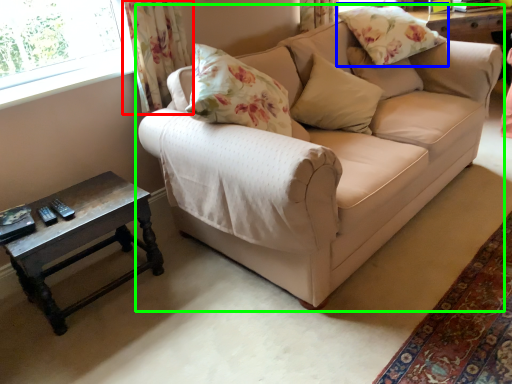
Question: Which is farther away from curtain (highlighted by a red box)? pillow (highlighted by a blue box) or studio couch (highlighted by a green box)?

Choices:
 (A) pillow
 (B) studio couch

Answer: (A)